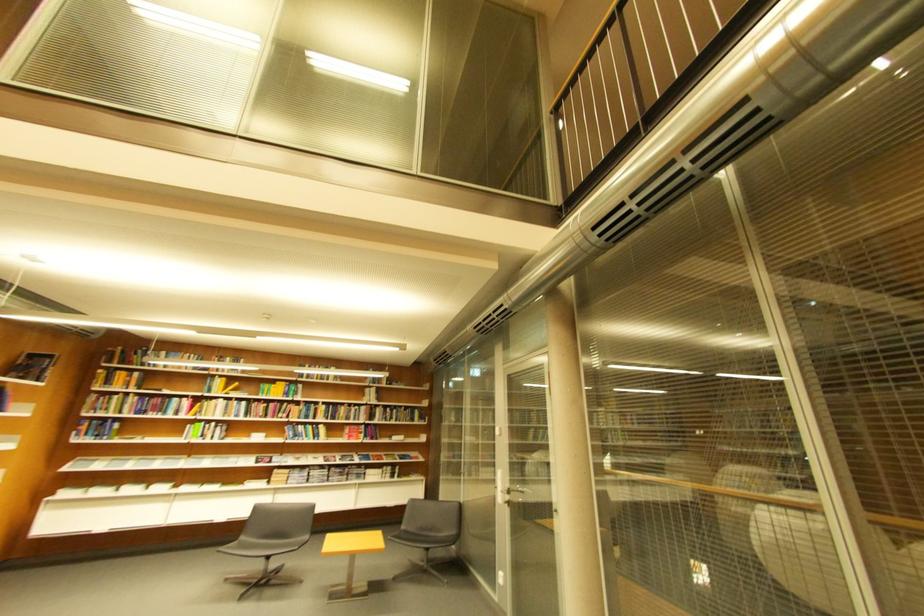
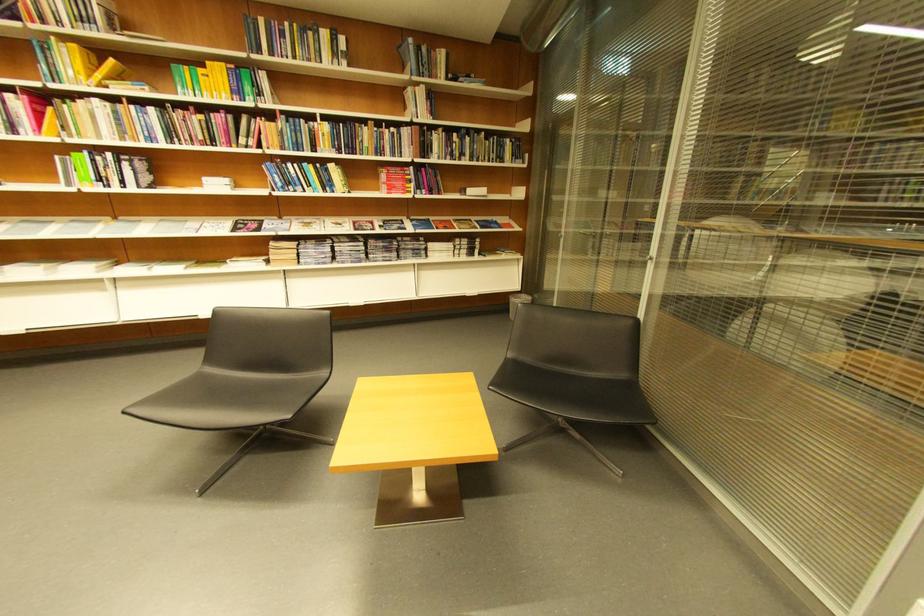
Locate, in the second image, the point that corresponds to (235,381) in the first image.

(84, 47)